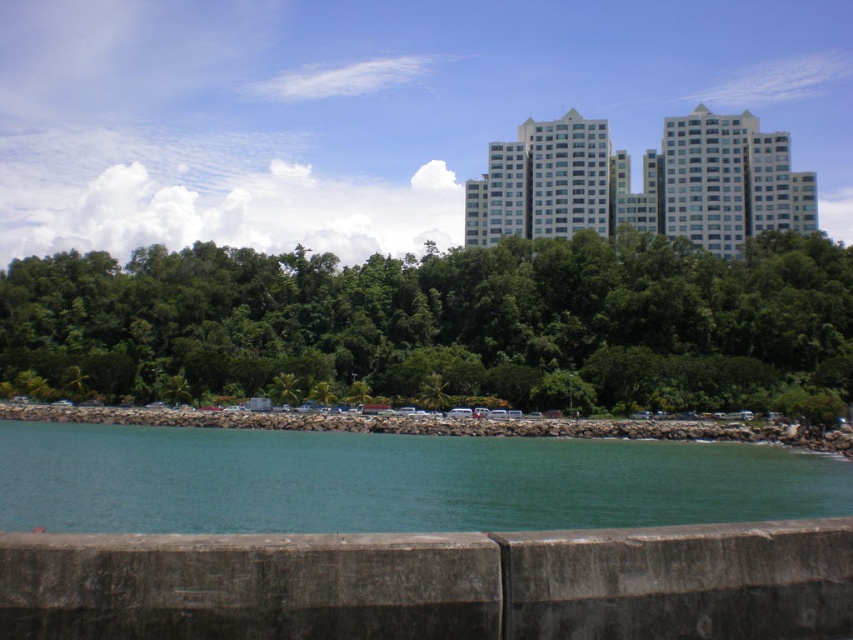
Based on the photo, you are a drone operator who needs to fly a drone from the green leafy trees at center to the white glossy building at upper center. The drone has a maximum flight range of 200 feet. Can you safely make the trip without needing to recharge?

The green leafy trees at center is 205.70 feet from the white glossy building at upper center. Since the distance exceeds the drone maximum flight range of 200 feet, the drone cannot safely make the trip without needing to recharge.

You are a city planner reviewing the coastal area. You need to determine which object between the green leafy trees at center and the white glossy building at upper center occupies more horizontal space in the image. Based on the scene, which one is wider?

The green leafy trees at center are wider than the white glossy building at upper center because their width surpasses the building.

You are standing on the concrete barrier looking out towards the teal water at lower center and the green leafy trees at center. Which object is closer to you?

The green leafy trees at center are closer to you because they are positioned further to the viewer than the teal water at lower center.